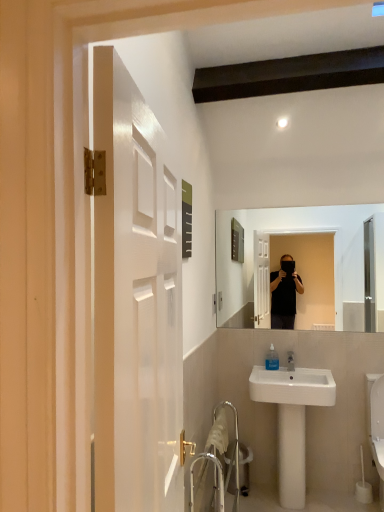
Question: Is white glossy toilet at lower right outside white ceramic sink at lower right?

Choices:
 (A) yes
 (B) no

Answer: (A)

Question: Does white glossy toilet at lower right have a greater width compared to white ceramic sink at lower right?

Choices:
 (A) no
 (B) yes

Answer: (B)

Question: Is white glossy toilet at lower right looking in the opposite direction of white ceramic sink at lower right?

Choices:
 (A) no
 (B) yes

Answer: (A)

Question: From a real-world perspective, is white glossy toilet at lower right located beneath white ceramic sink at lower right?

Choices:
 (A) yes
 (B) no

Answer: (A)

Question: Is white glossy toilet at lower right facing towards white ceramic sink at lower right?

Choices:
 (A) no
 (B) yes

Answer: (A)

Question: From the image's perspective, is white ceramic sink at lower right located above or below metallic silver trash can at lower center?

Choices:
 (A) below
 (B) above

Answer: (B)

Question: From a real-world perspective, is white ceramic sink at lower right above or below metallic silver trash can at lower center?

Choices:
 (A) below
 (B) above

Answer: (B)

Question: Is point (296, 416) closer or farther from the camera than point (244, 473)?

Choices:
 (A) farther
 (B) closer

Answer: (B)

Question: Visually, is white ceramic sink at lower right positioned to the left or to the right of metallic silver trash can at lower center?

Choices:
 (A) left
 (B) right

Answer: (B)

Question: In terms of width, does white glossy toilet at lower right look wider or thinner when compared to white ceramic sink at lower right?

Choices:
 (A) thin
 (B) wide

Answer: (B)

Question: From a real-world perspective, is white glossy toilet at lower right physically located above or below white ceramic sink at lower right?

Choices:
 (A) below
 (B) above

Answer: (A)

Question: Looking at the image, does white glossy toilet at lower right seem bigger or smaller compared to white ceramic sink at lower right?

Choices:
 (A) small
 (B) big

Answer: (A)

Question: Considering their positions, is white glossy toilet at lower right located in front of or behind white ceramic sink at lower right?

Choices:
 (A) behind
 (B) front

Answer: (B)

Question: Does point (299, 475) appear closer or farther from the camera than point (375, 394)?

Choices:
 (A) farther
 (B) closer

Answer: (B)

Question: Which is correct: white ceramic sink at lower right is inside white glossy toilet at lower right, or outside of it?

Choices:
 (A) inside
 (B) outside

Answer: (B)